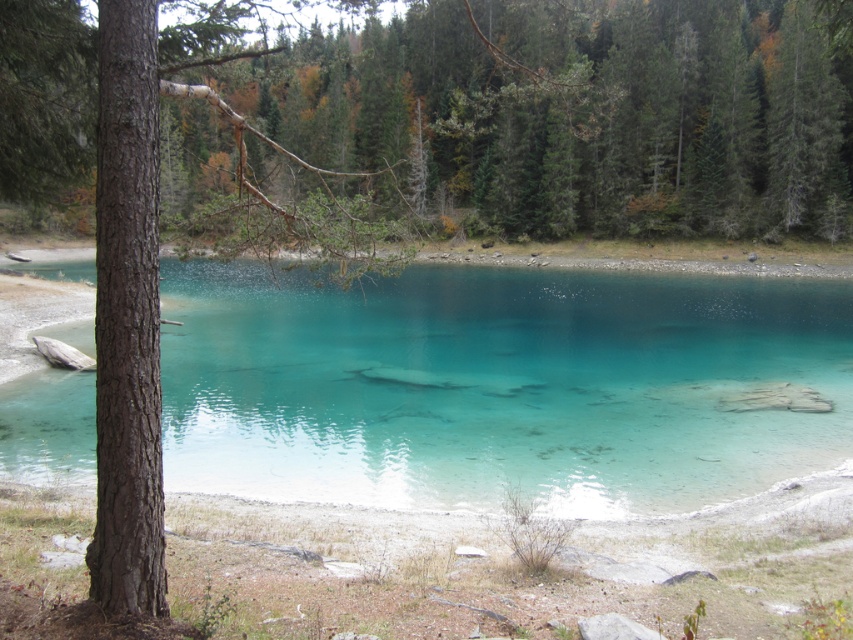
You are standing at the edge of the water and want to reach the green matte tree at upper center. Which direction should you move to get closer to it without crossing the clear glassy water at center?

You should move away from the clear glassy water at center because the green matte tree at upper center is behind it, so moving away from the water will bring you closer to the tree.

You are standing at the edge of the forest and want to cross the clear glassy water at center to reach the green matte tree at upper center. Can you walk directly across the water to get there?

The clear glassy water at center is smaller than the green matte tree at upper center, but since water is an obstacle, you cannot walk directly across it to reach the green matte tree at upper center. You should look for a bridge or a path around the water.

You are standing on the shore and want to take a photo of both the clear glassy water at center and the green matte tree at upper center. Which object should you position closer to the left side of your camera frame?

You should position the clear glassy water at center closer to the left side of your camera frame because it is already to the left of the green matte tree at upper center in the scene.